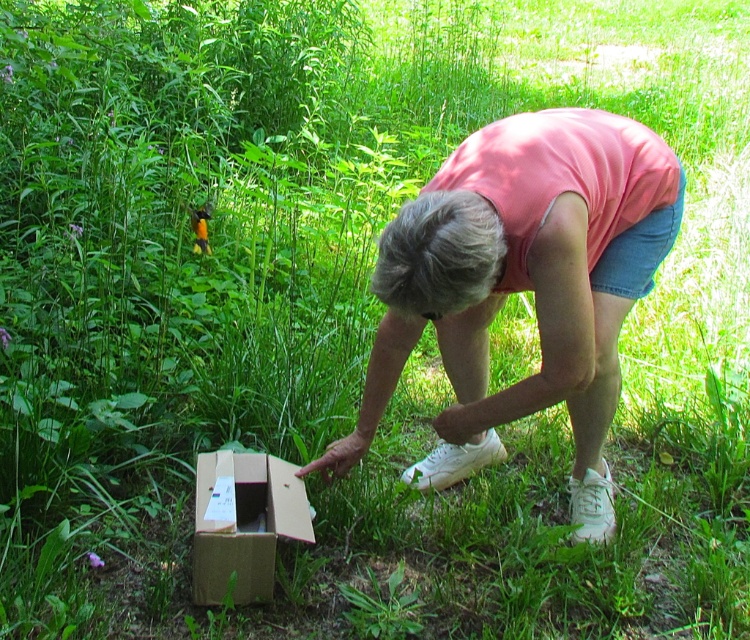
Question: Which of the following is the farthest from the observer?

Choices:
 (A) pink fabric squat at center
 (B) cardboard box at lower left

Answer: (B)

Question: Is pink fabric squat at center thinner than cardboard box at lower left?

Choices:
 (A) yes
 (B) no

Answer: (B)

Question: Observing the image, what is the correct spatial positioning of pink fabric squat at center in reference to cardboard box at lower left?

Choices:
 (A) above
 (B) below

Answer: (A)

Question: Which point is farther from the camera taking this photo?

Choices:
 (A) tap(264, 534)
 (B) tap(450, 349)

Answer: (B)

Question: From the image, what is the correct spatial relationship of pink fabric squat at center in relation to cardboard box at lower left?

Choices:
 (A) above
 (B) below

Answer: (A)